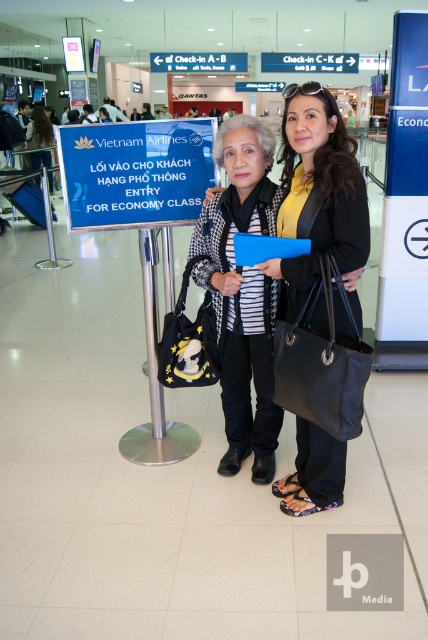
Who is higher up, black textured coat at center or matte black handbag at center?

Positioned higher is matte black handbag at center.

At what (x,y) coordinates should I click in order to perform the action: click on black textured coat at center. Please return your answer as a coordinate pair (x, y). This screenshot has width=428, height=640. Looking at the image, I should click on (241, 291).

Identify the location of black textured coat at center. (241, 291).

Based on the photo, can you confirm if black leather handbag at center is wider than black textured coat at center?

Yes.

Identify the location of black leather handbag at center. This screenshot has width=428, height=640. (318, 198).

At what (x,y) coordinates should I click in order to perform the action: click on black leather handbag at center. Please return your answer as a coordinate pair (x, y). The height and width of the screenshot is (640, 428). Looking at the image, I should click on pos(318,198).

Which is in front, point (300, 502) or point (44, 145)?

Point (300, 502)

Can you confirm if black leather handbag at center is positioned to the left of matte black handbag at center?

Incorrect, black leather handbag at center is not on the left side of matte black handbag at center.

What do you see at coordinates (318, 198) in the screenshot? I see `black leather handbag at center` at bounding box center [318, 198].

Identify the location of black leather handbag at center. (318, 198).